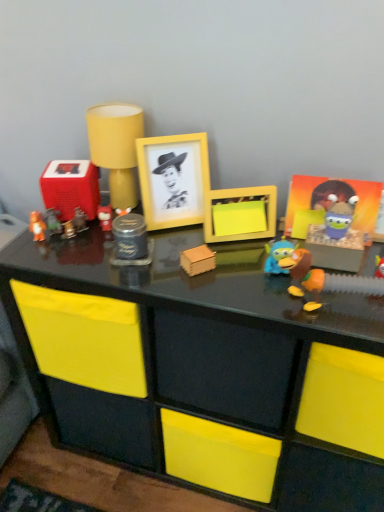
This screenshot has width=384, height=512. In order to click on free location in front of shiny metallic can at center, which appears as the 8th toy when viewed from the left in this screenshot , I will do click(x=161, y=281).